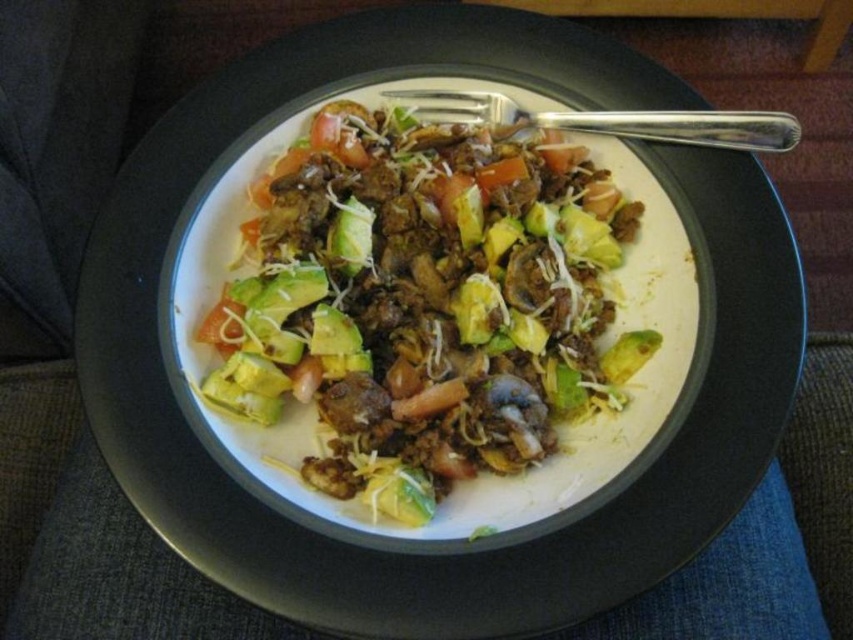
You are at a picnic and see the shiny avocado salad at center and the green avocado at center on the plate. Which one is located below the other?

The shiny avocado salad at center is positioned under green avocado at center, so the shiny avocado salad at center is below the green avocado at center.

You are a food critic evaluating the presentation of this dish. Based on the placement of the satin silver fork at upper right and the green avocado at center, which object is positioned higher up in the image?

The satin silver fork at upper right is positioned higher up in the image than the green avocado at center because it is taller.

You are sitting on the couch and looking at the plate of food on your lap. There are two points marked on the plate. Which point is closer to you, point at coordinates [514,109] or point at coordinates [344,241]?

Point at coordinates [514,109] is closer to you than point at coordinates [344,241] because it is further to the viewer.